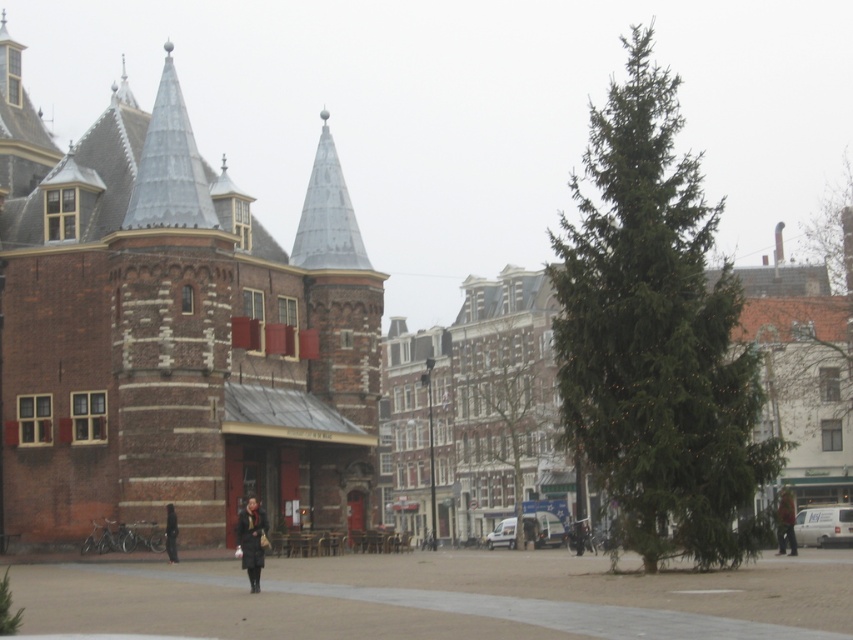
Question: Does dark brown leather jacket at lower right appear on the left side of dark gray coat at center?

Choices:
 (A) yes
 (B) no

Answer: (B)

Question: Can you confirm if smooth concrete pavement at center is wider than green textured tree at center?

Choices:
 (A) no
 (B) yes

Answer: (B)

Question: Considering the real-world distances, which object is farthest from the dark brown leather coat at lower center?

Choices:
 (A) dark brown leather jacket at lower right
 (B) dark gray coat at center

Answer: (A)

Question: Can you confirm if smooth concrete pavement at center is wider than dark gray coat at center?

Choices:
 (A) yes
 (B) no

Answer: (A)

Question: Which object is positioned closest to the dark gray coat at center?

Choices:
 (A) dark brown leather jacket at lower right
 (B) green textured pine tree at right
 (C) smooth concrete pavement at center

Answer: (C)

Question: Which point is closer to the camera?

Choices:
 (A) (838, 189)
 (B) (254, 529)
 (C) (779, 529)
 (D) (165, 536)

Answer: (B)